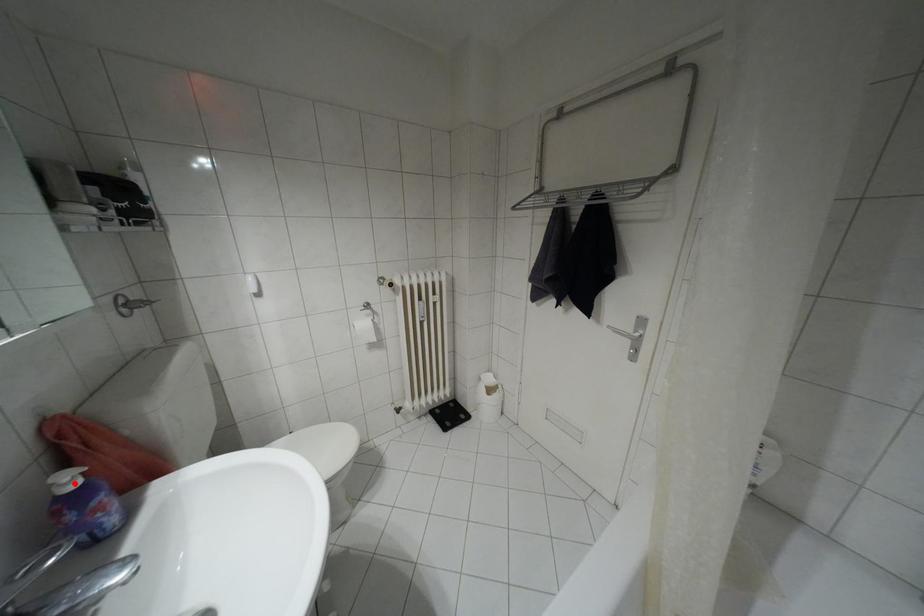
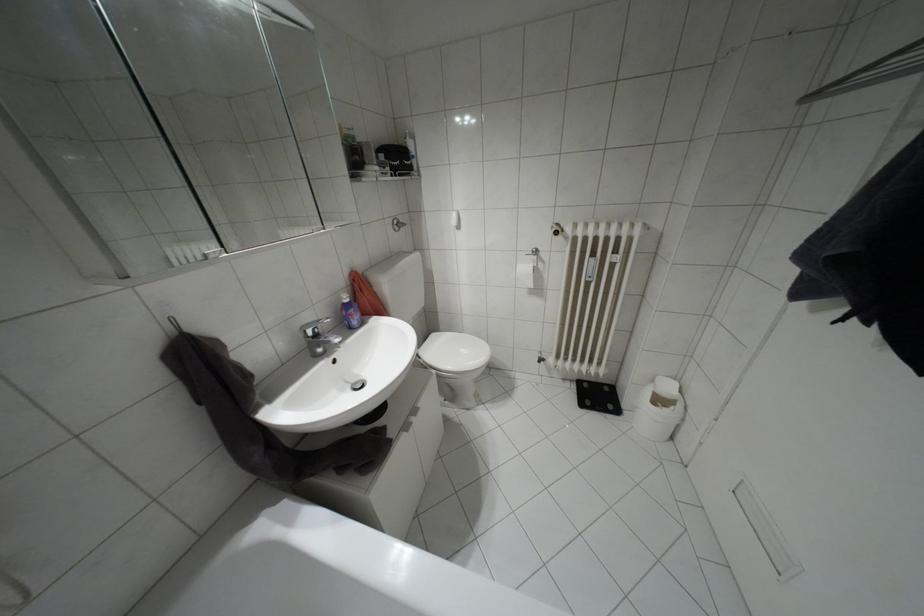
Where in the second image is the point corresponding to the highlighted location from the first image?

(346, 300)